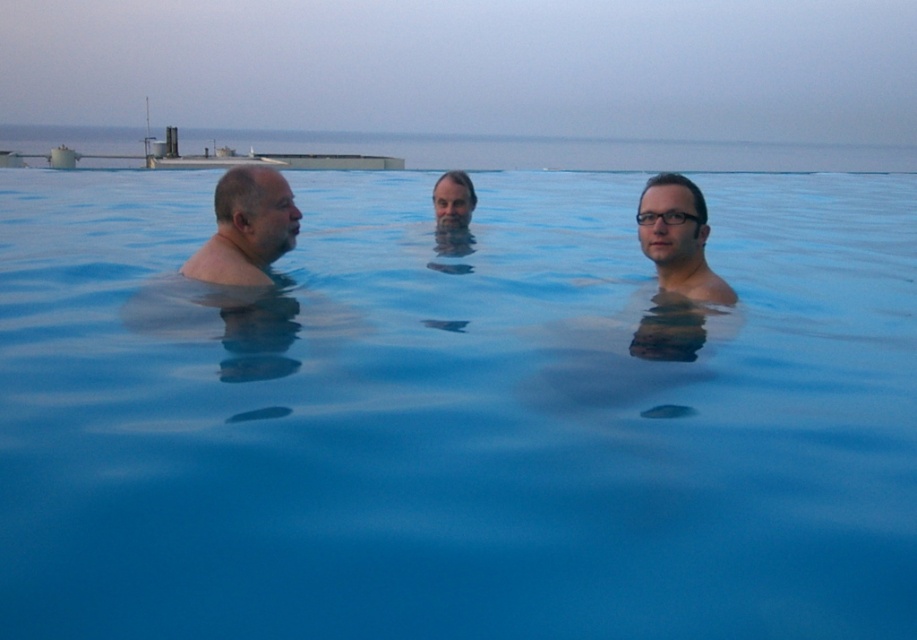
Question: Estimate the real-world distances between objects in this image. Which object is farther from the clear plastic glasses at center?

Choices:
 (A) blue smooth water at center
 (B) matte black hair at center
 (C) smooth skin head at left

Answer: (A)

Question: Is matte black hair at center smaller than clear plastic glasses at center?

Choices:
 (A) no
 (B) yes

Answer: (A)

Question: Estimate the real-world distances between objects in this image. Which object is farther from the smooth skin head at left?

Choices:
 (A) blue smooth water at center
 (B) clear plastic glasses at center

Answer: (B)

Question: Does blue smooth water at center appear over matte black hair at center?

Choices:
 (A) yes
 (B) no

Answer: (A)

Question: Among these points, which one is nearest to the camera?

Choices:
 (A) (208, 573)
 (B) (668, 220)
 (C) (675, 220)
 (D) (216, 275)

Answer: (A)

Question: Does smooth skin head at left come in front of clear plastic glasses at center?

Choices:
 (A) no
 (B) yes

Answer: (A)